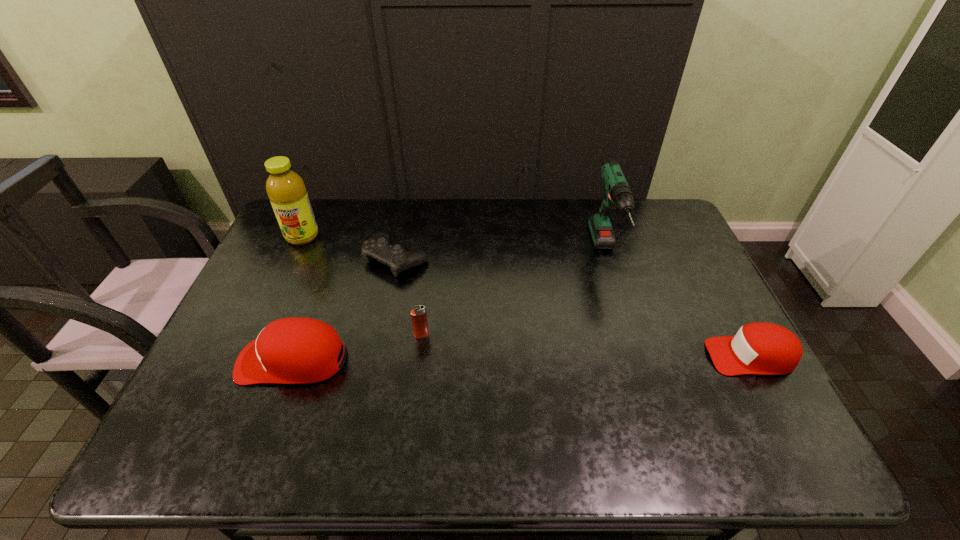
Find the location of a particular element. The image size is (960, 540). the left baseball cap is located at coordinates tap(297, 350).

Where is `the second shortest object`? the second shortest object is located at coordinates (761, 348).

Find the location of a particular element. This screenshot has width=960, height=540. the shorter baseball cap is located at coordinates (761, 348).

In order to click on control in this screenshot , I will do `click(378, 247)`.

Find the location of a particular element. This screenshot has height=540, width=960. drill is located at coordinates (618, 194).

Locate an element on the screen. This screenshot has width=960, height=540. igniter is located at coordinates (418, 315).

The height and width of the screenshot is (540, 960). I want to click on fruit juice, so click(x=286, y=190).

At what (x,y) coordinates should I click in order to perform the action: click on free space located on the front-facing side of the rightmost object. Please return your answer as a coordinate pair (x, y). Image resolution: width=960 pixels, height=540 pixels. Looking at the image, I should click on (615, 356).

Where is `free space located on the front-facing side of the rightmost object`? free space located on the front-facing side of the rightmost object is located at coordinates (673, 356).

Find the location of a particular element. The height and width of the screenshot is (540, 960). free spot located 0.180m on the front-facing side of the rightmost object is located at coordinates (638, 356).